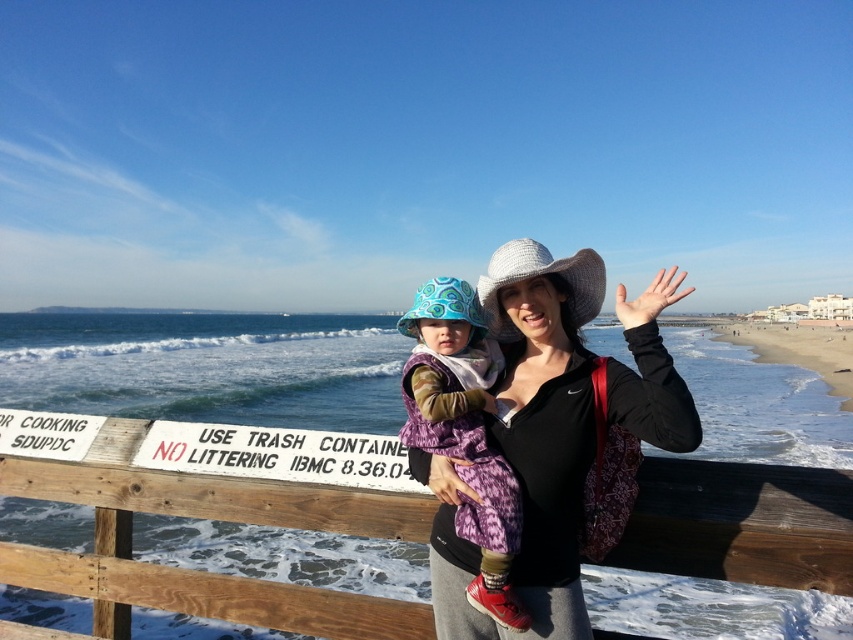
Is matte black jacket at center below patterned fabric baby carrier at center?

Incorrect, matte black jacket at center is not positioned below patterned fabric baby carrier at center.

Does matte black jacket at center have a lesser width compared to patterned fabric baby carrier at center?

No, matte black jacket at center is not thinner than patterned fabric baby carrier at center.

Does point (532, 636) come behind point (450, 436)?

No, it is not.

Locate an element on the screen. matte black jacket at center is located at coordinates (527, 444).

Can you confirm if matte black jacket at center is smaller than white painted wood sign at lower center?

No, matte black jacket at center is not smaller than white painted wood sign at lower center.

Is matte black jacket at center behind white painted wood sign at lower center?

No, matte black jacket at center is in front of white painted wood sign at lower center.

Between point (527, 483) and point (405, 483), which one is positioned behind?

The point (405, 483) is behind.

At what (x,y) coordinates should I click in order to perform the action: click on matte black jacket at center. Please return your answer as a coordinate pair (x, y). Looking at the image, I should click on (527, 444).

Who is lower down, wooden at center or matte black jacket at center?

wooden at center is below.

Can you confirm if wooden at center is taller than matte black jacket at center?

No.

Identify the location of wooden at center. (206, 518).

Locate an element on the screen. wooden at center is located at coordinates (206, 518).